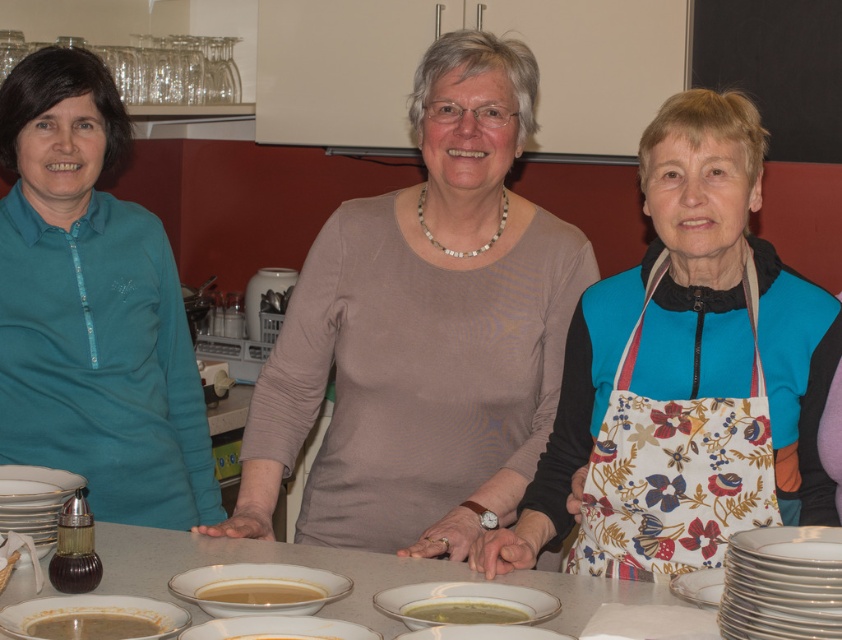
Question: Does white ceramic plate at center appear on the left side of smooth creamy soup at center?

Choices:
 (A) yes
 (B) no

Answer: (B)

Question: Which point is closer to the camera taking this photo?

Choices:
 (A) (307, 584)
 (B) (721, 292)

Answer: (A)

Question: Estimate the real-world distances between objects in this image. Which object is farther from the brown matte soup at lower left?

Choices:
 (A) matte beige blouse at center
 (B) white porcelain plate at center

Answer: (A)

Question: Is white ceramic bowl at center bigger than brown matte soup at lower left?

Choices:
 (A) no
 (B) yes

Answer: (B)

Question: Which point is farther to the camera?

Choices:
 (A) (259, 588)
 (B) (616, 592)
 (C) (88, 637)
 (D) (457, 636)

Answer: (B)

Question: Does white porcelain plate at center lie behind green creamy soup at center?

Choices:
 (A) no
 (B) yes

Answer: (A)